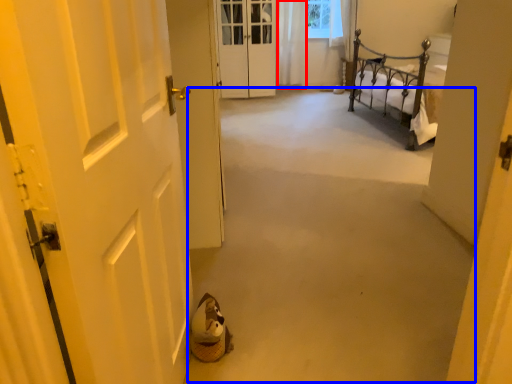
Question: Which point is closer to the camera, curtain (highlighted by a red box) or corridor (highlighted by a blue box)?

Choices:
 (A) curtain
 (B) corridor

Answer: (B)